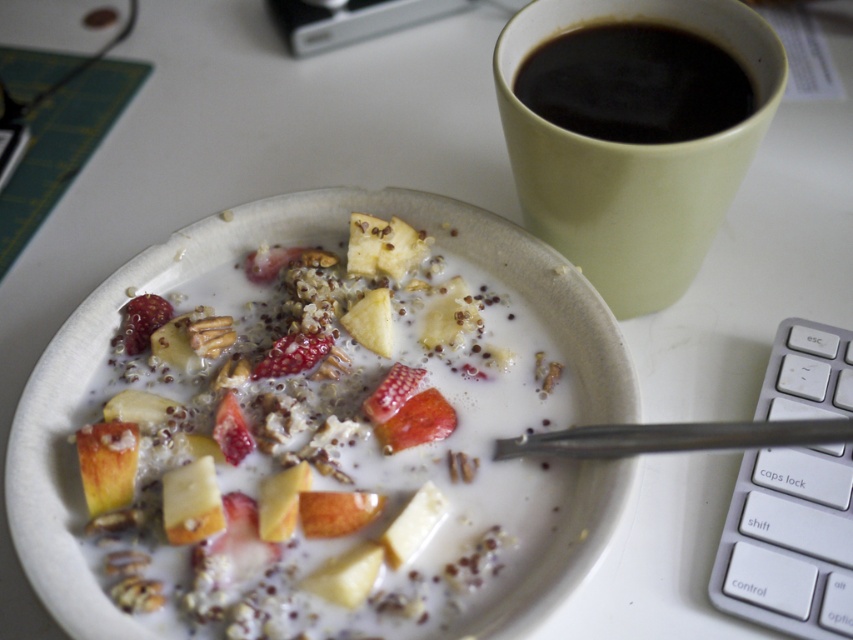
Which is more to the left, matte green cup at upper right or black matte cup at upper right?

black matte cup at upper right

Is matte green cup at upper right to the right of black matte cup at upper right from the viewer's perspective?

Yes, matte green cup at upper right is to the right of black matte cup at upper right.

Is point (709, 20) in front of point (621, 52)?

That is True.

The width and height of the screenshot is (853, 640). In order to click on matte green cup at upper right in this screenshot , I will do `click(631, 156)`.